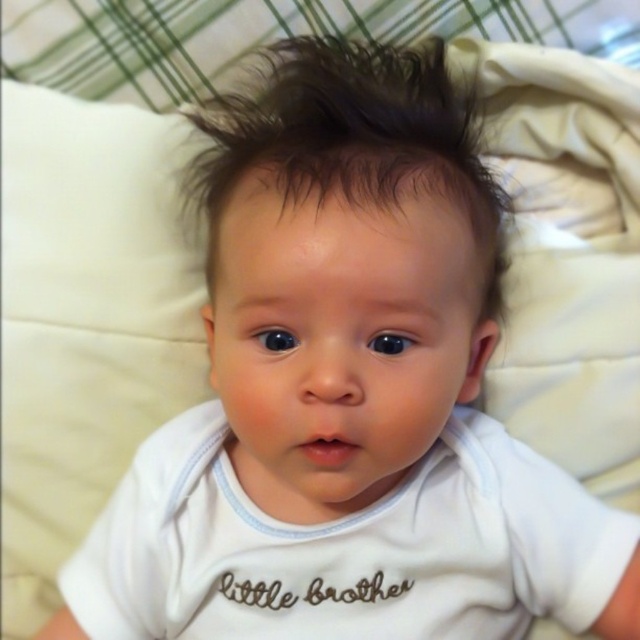
You are a photographer taking a picture of the baby. You notice the white soft fabric shirt at center and the dark brown shiny hair at center. Which object appears taller in the photo?

The dark brown shiny hair at center appears taller than the white soft fabric shirt at center in the photo.

Based on the scene description, where is the white soft fabric shirt at center located relative to the dark brown shiny hair at center?

The white soft fabric shirt at center is to the right of dark brown shiny hair at center.

You are a photographer setting up for a baby photoshoot. The baby is lying on a white quilted surface, and you need to position a small prop exactly at the center of the white soft fabric shirt at center. Where should you place the prop in terms of coordinates?

The prop should be placed at the coordinates specified by the 2D location of the white soft fabric shirt at center, which is at point (348, 547).